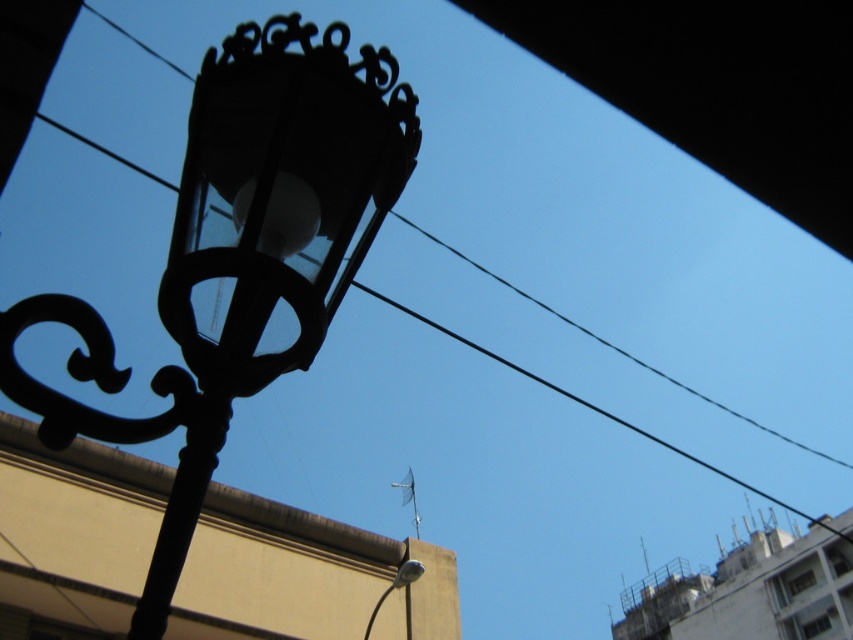
You are a city planner checking the distance between two streetlights for maintenance. The black wrought iron lamp post at upper left and the metallic silver streetlight at lower center are both in your view. According to the standard, the minimum distance between two streetlights should be 10 meters. Can the current spacing between them meet the requirement?

The black wrought iron lamp post at upper left and the metallic silver streetlight at lower center are 9.92 meters apart. Since the minimum required distance is 10 meters, the current spacing does not meet the requirement as it is slightly less than the standard.

You are a pedestrian standing on the sidewalk and see both the black wrought iron lamp post at upper left and the metallic silver streetlight at lower center. Which one is closer to you?

The black wrought iron lamp post at upper left is closer to you because it is in front of the metallic silver streetlight at lower center.

You are a city planner assessing the spacing between two streetlights in the image. The black wrought iron lamp post at upper left and the metallic silver streetlight at lower center are both visible. Which of these two occupies a smaller area in the image?

The black wrought iron lamp post at upper left occupies less space than the metallic silver streetlight at lower center, so it is the smaller one in terms of area.